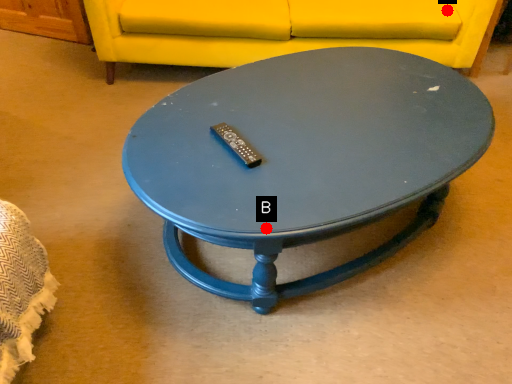
Question: Two points are circled on the image, labeled by A and B beside each circle. Which point is closer to the camera taking this photo?

Choices:
 (A) A is closer
 (B) B is closer

Answer: (B)